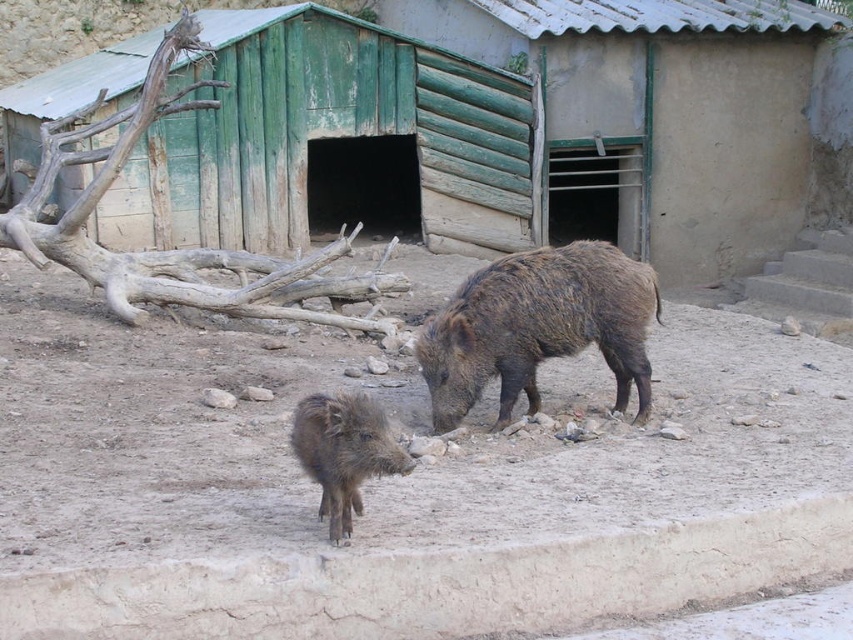
Does brown sandy dirt at center lie behind brown fuzzy piglet at center?

Yes, it is behind brown fuzzy piglet at center.

Does brown sandy dirt at center have a larger size compared to brown fuzzy piglet at center?

Correct, brown sandy dirt at center is larger in size than brown fuzzy piglet at center.

Does point (387, 388) come farther from viewer compared to point (345, 403)?

Yes, it is.

Locate an element on the screen. brown sandy dirt at center is located at coordinates (393, 484).

Can you confirm if brown rough textured pig at center is taller than brown fuzzy piglet at center?

Correct, brown rough textured pig at center is much taller as brown fuzzy piglet at center.

Can you confirm if brown rough textured pig at center is positioned to the left of brown fuzzy piglet at center?

Incorrect, brown rough textured pig at center is not on the left side of brown fuzzy piglet at center.

What do you see at coordinates (538, 326) in the screenshot?
I see `brown rough textured pig at center` at bounding box center [538, 326].

This screenshot has width=853, height=640. What are the coordinates of `brown rough textured pig at center` in the screenshot? It's located at (538, 326).

Looking at this image, does brown sandy dirt at center appear on the right side of brown rough textured pig at center?

Indeed, brown sandy dirt at center is positioned on the right side of brown rough textured pig at center.

Is brown sandy dirt at center wider than brown rough textured pig at center?

Correct, the width of brown sandy dirt at center exceeds that of brown rough textured pig at center.

At what (x,y) coordinates should I click in order to perform the action: click on brown sandy dirt at center. Please return your answer as a coordinate pair (x, y). Looking at the image, I should click on (393, 484).